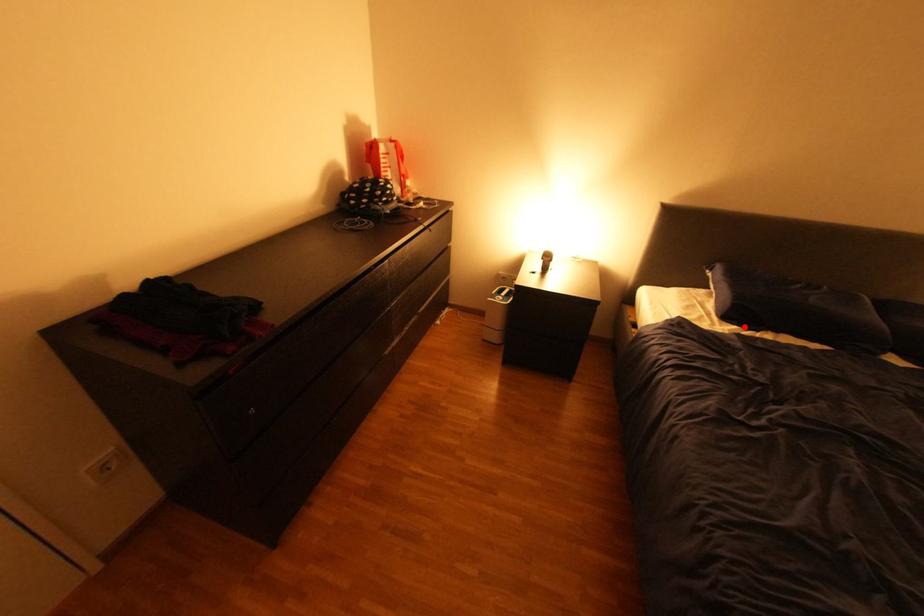
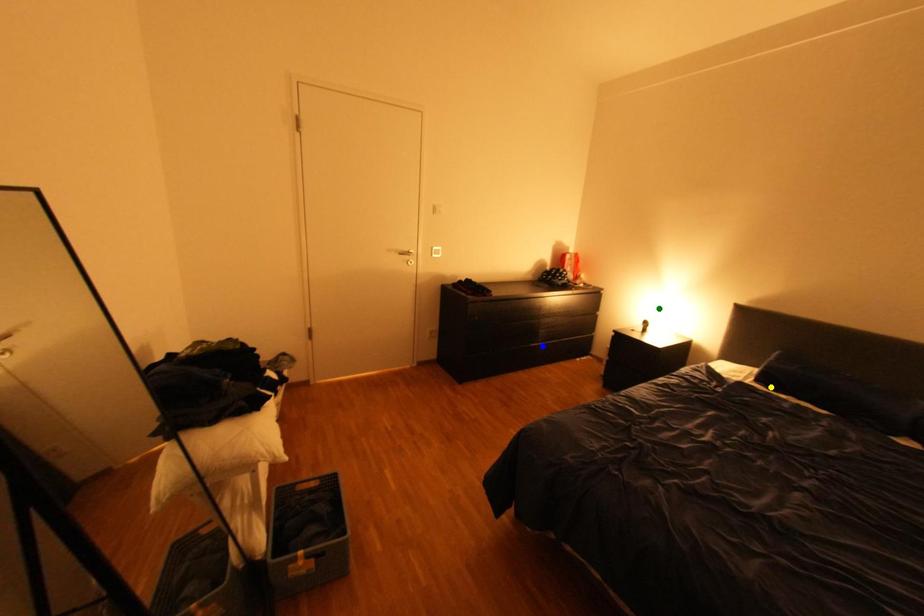
Question: I am providing you with two images of the same scene from different viewpoints. A red point is marked on the first image. You are given multiple points on the second image. Which mark in image 2 goes with the point in image 1?

Choices:
 (A) green point
 (B) blue point
 (C) yellow point

Answer: (C)